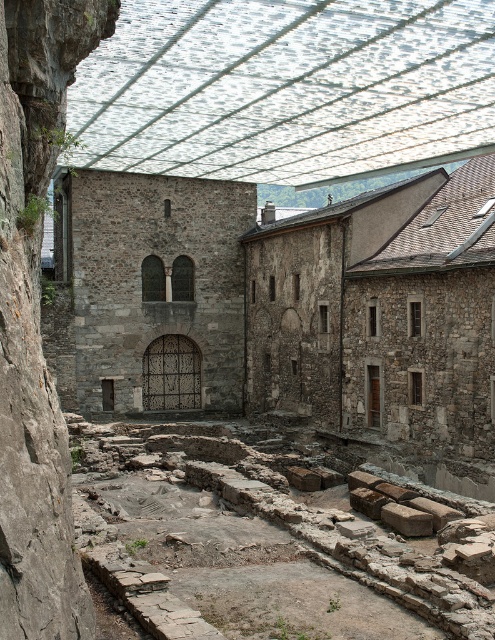
Question: Which point appears closest to the camera in this image?

Choices:
 (A) (203, 304)
 (B) (283, 484)

Answer: (B)

Question: In this image, where is gray stone ruins at lower center located relative to rustic stone ruins at center?

Choices:
 (A) right
 (B) left

Answer: (A)

Question: Can you confirm if gray stone ruins at lower center is positioned to the right of rustic stone ruins at center?

Choices:
 (A) yes
 (B) no

Answer: (A)

Question: Is gray stone ruins at lower center positioned in front of rustic stone ruins at center?

Choices:
 (A) no
 (B) yes

Answer: (B)

Question: Among these points, which one is farthest from the camera?

Choices:
 (A) (152, 288)
 (B) (242, 604)

Answer: (A)

Question: Which point appears farthest from the camera in this image?

Choices:
 (A) (220, 280)
 (B) (141, 540)

Answer: (A)